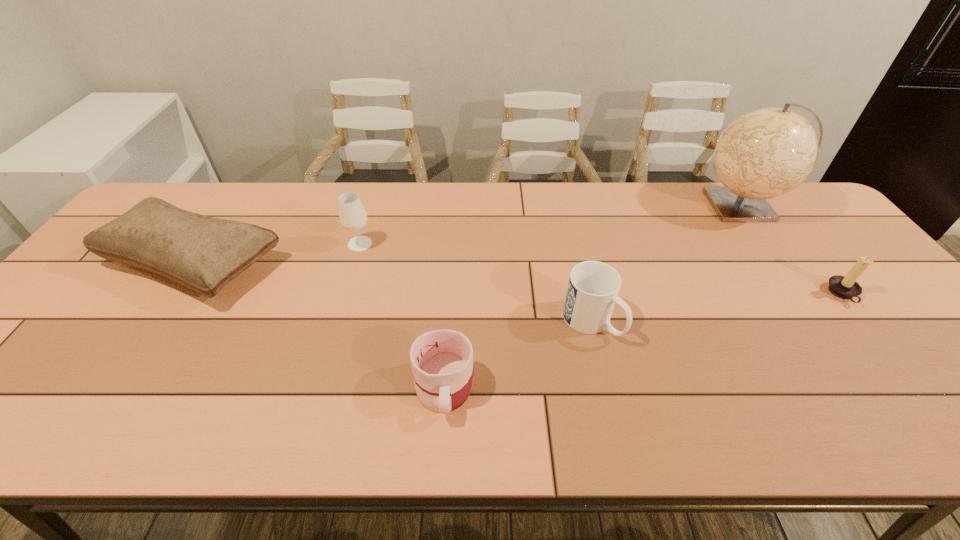
Identify the location of free space between the cushion and the farther mug. The height and width of the screenshot is (540, 960). (393, 293).

Identify the location of free space between the candle holder and the shorter mug. (643, 340).

Image resolution: width=960 pixels, height=540 pixels. In order to click on free spot between the farther mug and the third object from left to right in this screenshot , I will do `click(517, 354)`.

Locate an element on the screen. vacant space that is in between the cushion and the fifth object from right to left is located at coordinates (276, 254).

Locate an element on the screen. Image resolution: width=960 pixels, height=540 pixels. free space between the tallest object and the right mug is located at coordinates (666, 264).

Identify the location of vacant space that is in between the tallest object and the glass. The width and height of the screenshot is (960, 540). coord(551,225).

I want to click on vacant area that lies between the right mug and the globe, so click(x=666, y=264).

Identify the location of free spot between the fifth object from right to left and the tallest object. This screenshot has width=960, height=540. (551, 225).

The height and width of the screenshot is (540, 960). I want to click on object that is the closest one to the globe, so click(x=845, y=287).

You are a GUI agent. You are given a task and a screenshot of the screen. Output one action in this format:
    pyautogui.click(x=<x>, y=<y>)
    Task: Click on the object that is the third closest one to the left mug
    
    Given the screenshot: What is the action you would take?
    pyautogui.click(x=203, y=253)